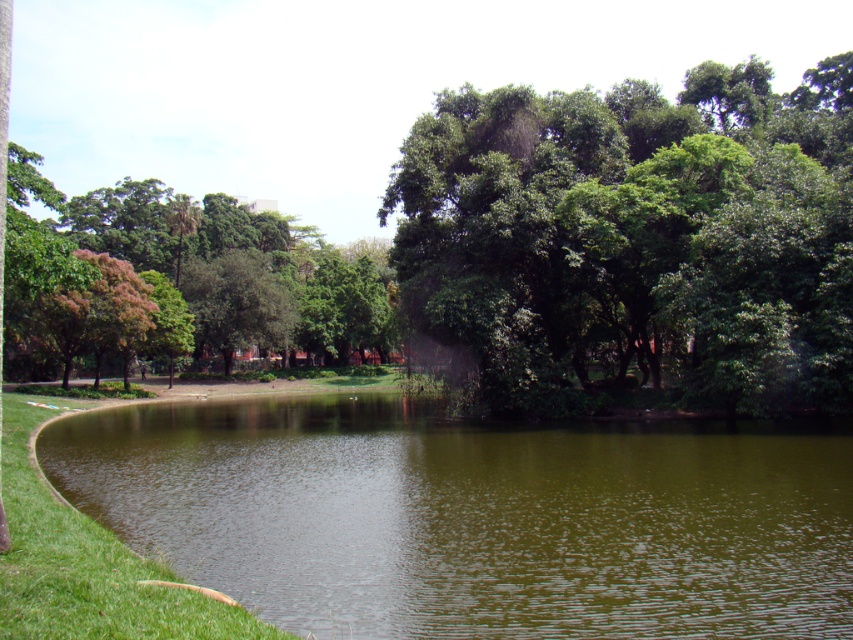
Looking at this image, you are standing at the edge of the park pond and see two points marked in the image. The first point is at coordinates point (552, 342) and the second is at point (50, 636). Which point is closer to your current position?

Point (50, 636) is closer to your current position because it is nearer to the camera compared to point (552, 342), which is further away.

From the picture: You are standing in the park and want to take a photo of the green leafy tree at upper left and the green grass at lower left. Which object should you focus on first if you want to capture both in a single frame without moving the camera?

You should focus on the green leafy tree at upper left first because it is positioned on the left side of the green grass at lower left, so it will be naturally included in the frame when centered on the grass.

You are a bird flying over the park and want to land on the closest object. Which object should you choose between the green liquid water at center and the green leafy tree at upper left?

The green liquid water at center is thinner than the green leafy tree at upper left, so the green leafy tree at upper left is closer to you and you should land there.